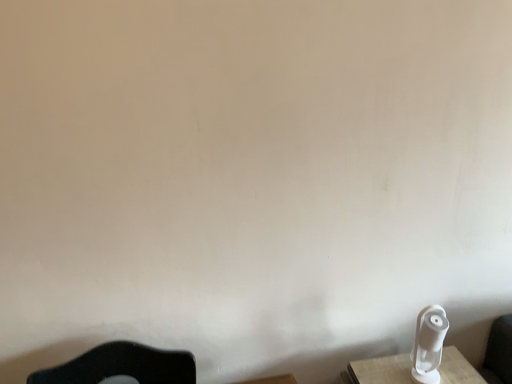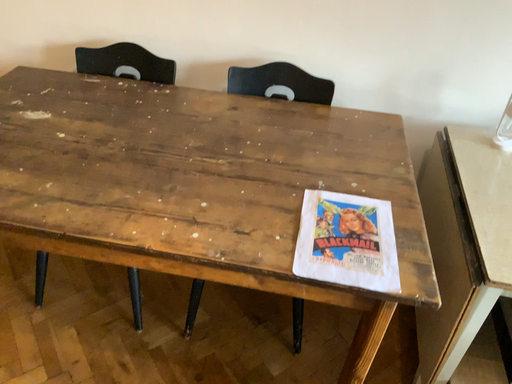
Question: How did the camera likely rotate when shooting the video?

Choices:
 (A) rotated downward
 (B) rotated upward

Answer: (A)